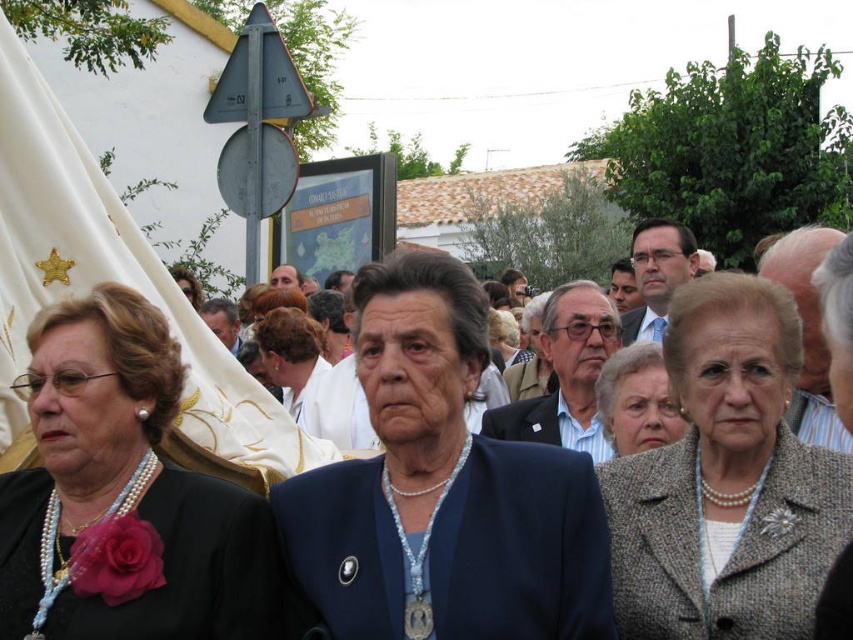
Does blue fabric jacket at center lie behind light brown hair at center?

No.

Which is above, blue fabric jacket at center or light brown hair at center?

Positioned higher is light brown hair at center.

Does point (427, 506) come behind point (268, 372)?

No.

I want to click on blue fabric jacket at center, so click(442, 490).

What do you see at coordinates (442, 490) in the screenshot?
I see `blue fabric jacket at center` at bounding box center [442, 490].

Locate an element on the screen. Image resolution: width=853 pixels, height=640 pixels. blue fabric jacket at center is located at coordinates (442, 490).

Does point (740, 509) lie behind point (314, 355)?

No, it is in front of (314, 355).

Who is more forward, [732,355] or [297,419]?

Point [732,355] is more forward.

Locate an element on the screen. pearl-gray tweed coat at center-right is located at coordinates (726, 481).